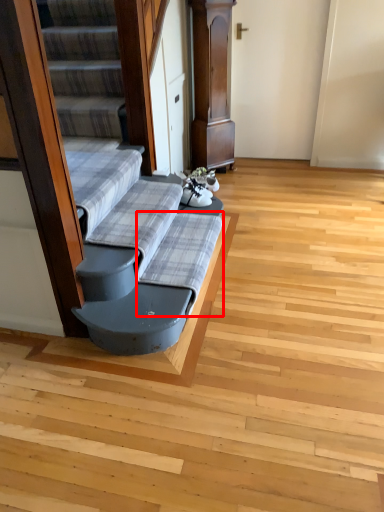
Question: From the image, what is the correct spatial relationship of sheet (annotated by the red box) in relation to sheet?

Choices:
 (A) left
 (B) right

Answer: (B)